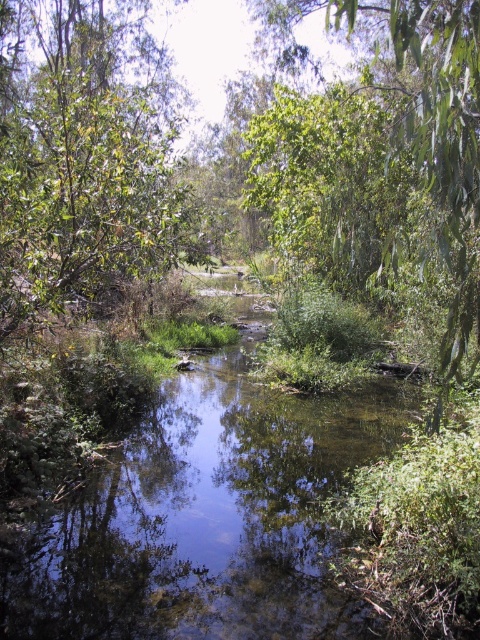
You are a photographer planning to capture the reflection of the green leafy tree at upper left in the clear water at center. Considering their sizes, will the tree fit entirely within the water surface in your photo?

The clear water at center has a smaller size compared to green leafy tree at upper left, so the tree may not fit entirely within the water surface in the photo.

While standing in the serene natural scene, you notice the clear water at center and the green leafy tree at upper left. From your perspective, which object is positioned to the left?

The green leafy tree at upper left is positioned to the left of the clear water at center.

You are standing in the natural scene and want to take a photo of the clear water at center and the green leafy tree at upper left. Which object should you focus on first if you want to capture both in sharp focus?

You should focus on the green leafy tree at upper left first because it is further away from the viewer than the clear water at center, ensuring both will be in focus when using a camera with a fixed focal plane.